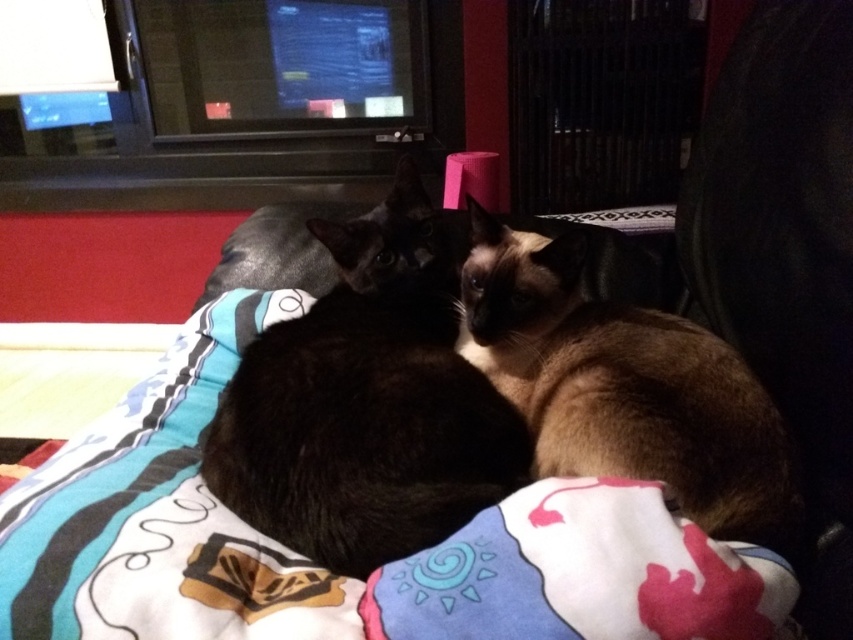
Question: Considering the real-world distances, which object is closest to the brown silky cat at center?

Choices:
 (A) silky black cat at center
 (B) printed cotton blanket at center

Answer: (A)

Question: Can you confirm if printed cotton blanket at center is thinner than brown silky cat at center?

Choices:
 (A) yes
 (B) no

Answer: (B)

Question: Can you confirm if printed cotton blanket at center is bigger than brown silky cat at center?

Choices:
 (A) yes
 (B) no

Answer: (A)

Question: Which object is closer to the camera taking this photo?

Choices:
 (A) printed cotton blanket at center
 (B) brown silky cat at center
 (C) silky black cat at center

Answer: (A)

Question: Which object appears closest to the camera in this image?

Choices:
 (A) printed cotton blanket at center
 (B) brown silky cat at center
 (C) silky black cat at center

Answer: (A)

Question: Does silky black cat at center appear on the right side of brown silky cat at center?

Choices:
 (A) no
 (B) yes

Answer: (A)